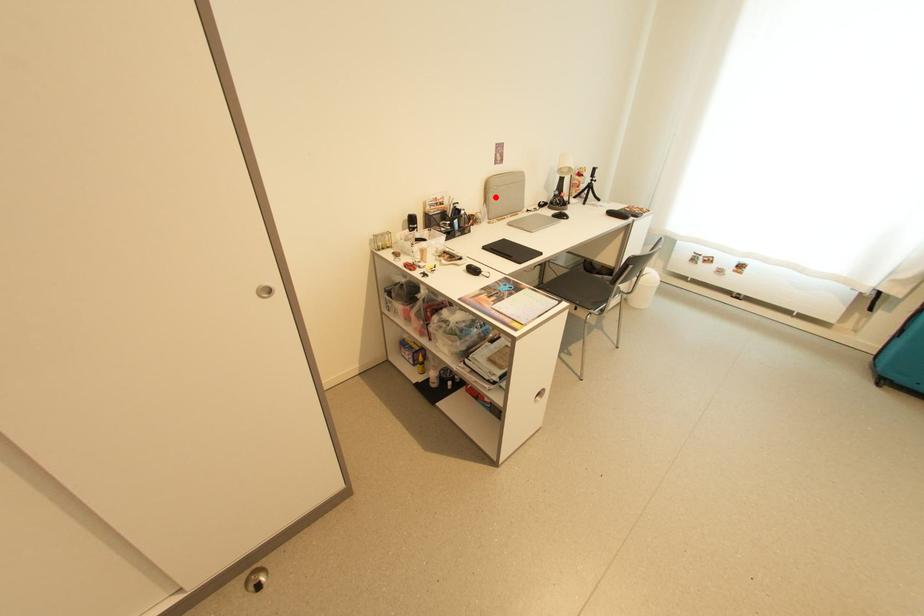
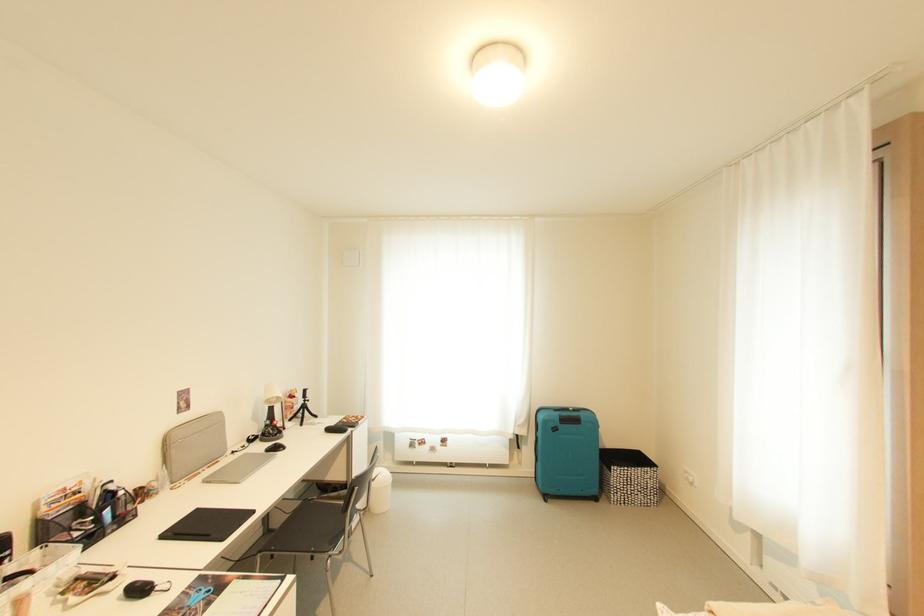
Locate, in the second image, the point that corresponds to the highlighted location in the first image.

(177, 455)